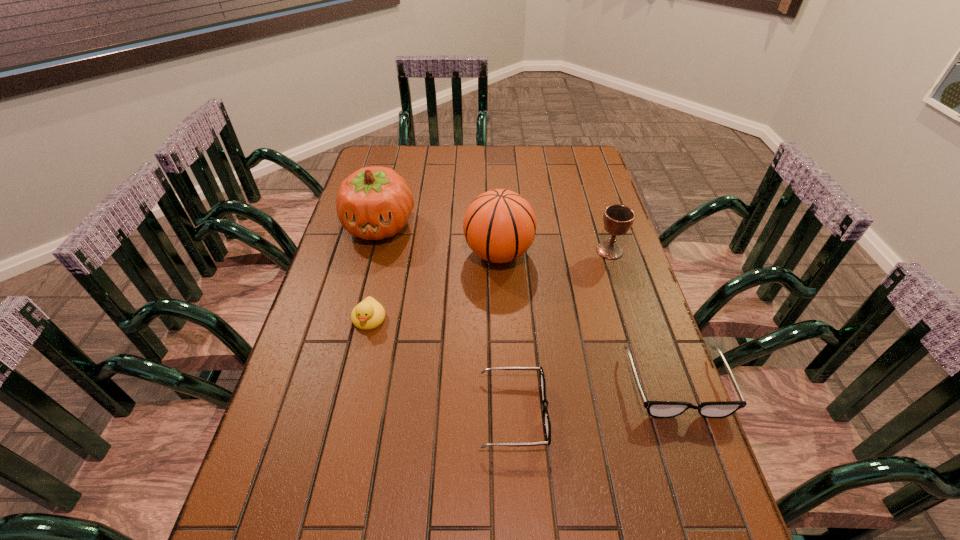
This screenshot has width=960, height=540. I want to click on the left spectacles, so click(546, 419).

Find the location of a particular element. The width and height of the screenshot is (960, 540). the shorter spectacles is located at coordinates (546, 419).

Find the location of a particular element. Image resolution: width=960 pixels, height=540 pixels. the fifth tallest object is located at coordinates (659, 409).

You are a GUI agent. You are given a task and a screenshot of the screen. Output one action in this format:
    pyautogui.click(x=<x>, y=<y>)
    Task: Click on the right spectacles
    The width and height of the screenshot is (960, 540).
    Given the screenshot: What is the action you would take?
    pyautogui.click(x=659, y=409)

The height and width of the screenshot is (540, 960). I want to click on basketball, so coord(499,226).

Identify the location of pumpkin. (373, 203).

Identify the location of duckling. The image size is (960, 540). (369, 314).

Locate an element on the screen. This screenshot has height=540, width=960. the fourth shortest object is located at coordinates tap(618, 219).

The height and width of the screenshot is (540, 960). What are the coordinates of `vacant space located on the front-facing side of the shortest object` in the screenshot? It's located at tap(626, 413).

You are a GUI agent. You are given a task and a screenshot of the screen. Output one action in this format:
    pyautogui.click(x=<x>, y=<y>)
    Task: Click on the free space located on the front-facing side of the fifth tallest object
    The width and height of the screenshot is (960, 540).
    Given the screenshot: What is the action you would take?
    pyautogui.click(x=716, y=496)